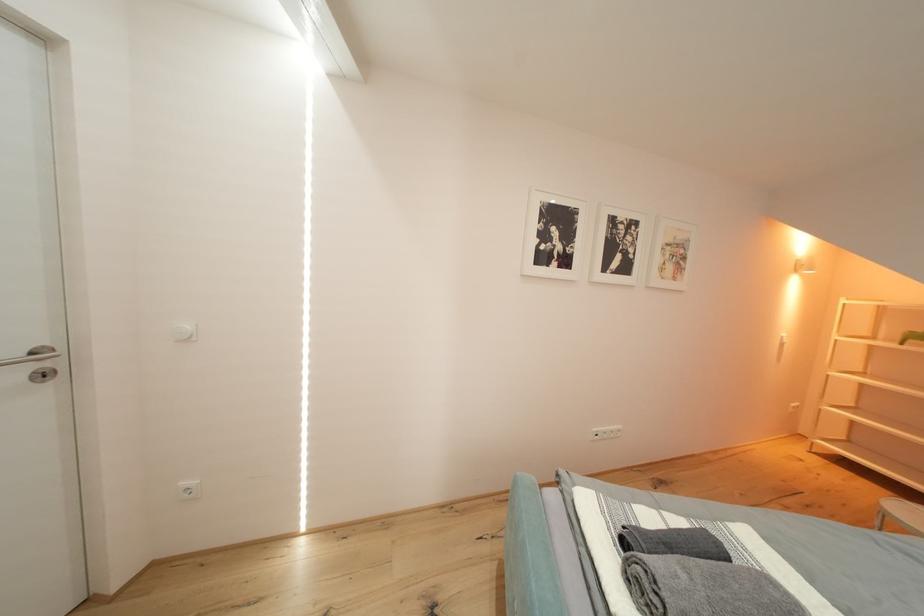
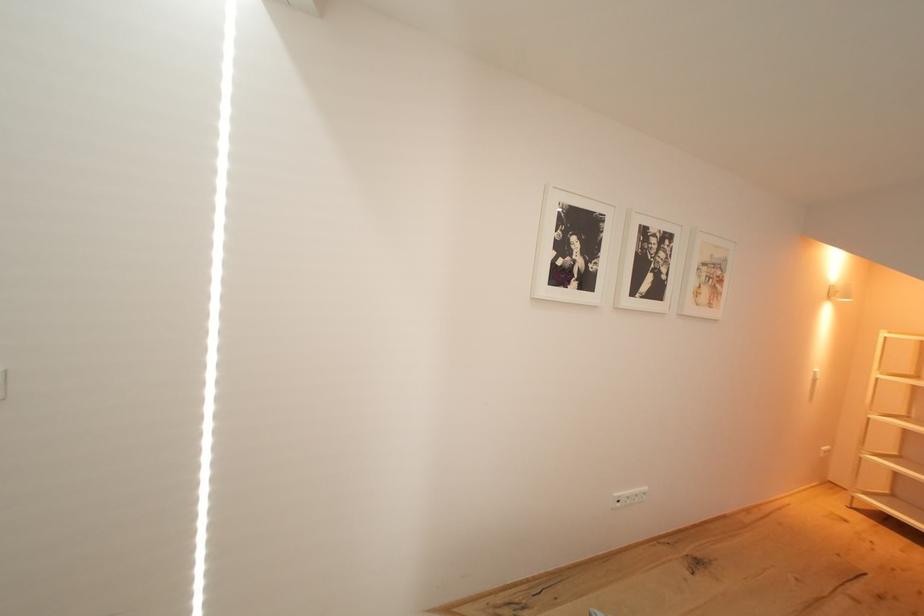
Question: The images are taken continuously from a first-person perspective. In which direction are you moving?

Choices:
 (A) Left
 (B) Right
 (C) Forward
 (D) Backward

Answer: (C)